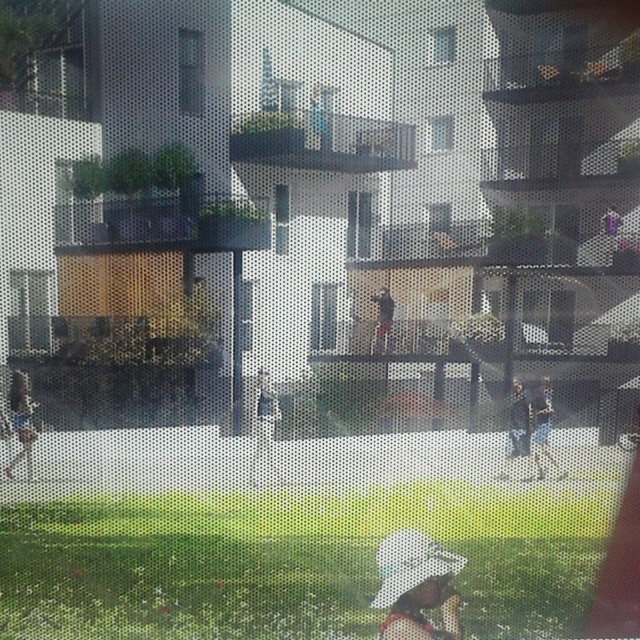
You are a delivery person trying to locate the recipient who is wearing either the white cotton shirt at lower left or the dark gray fabric jacket at center. Given that the minimum safe social distance is 6 feet, can you approach both individuals without violating the distance requirement?

The white cotton shirt at lower left and dark gray fabric jacket at center are 3.47 feet apart, which is less than the 6 feet requirement. Therefore, approaching both individuals would violate the social distance requirement.

You are a fashion designer observing a scene through a screen with a dotted pattern. In the image, you notice two clothing items on a grassy area. The first is a white cotton shirt at lower left and the second is a dark gray fabric jacket at center. Which clothing item is larger in size?

The white cotton shirt at lower left is bigger than the dark gray fabric jacket at center.

Consider the image. You are standing in the courtyard and see the white cotton shirt at lower left and dark blue jeans at center. Which clothing item is positioned more to the left?

The white cotton shirt at lower left is positioned more to the left than the dark blue jeans at center.